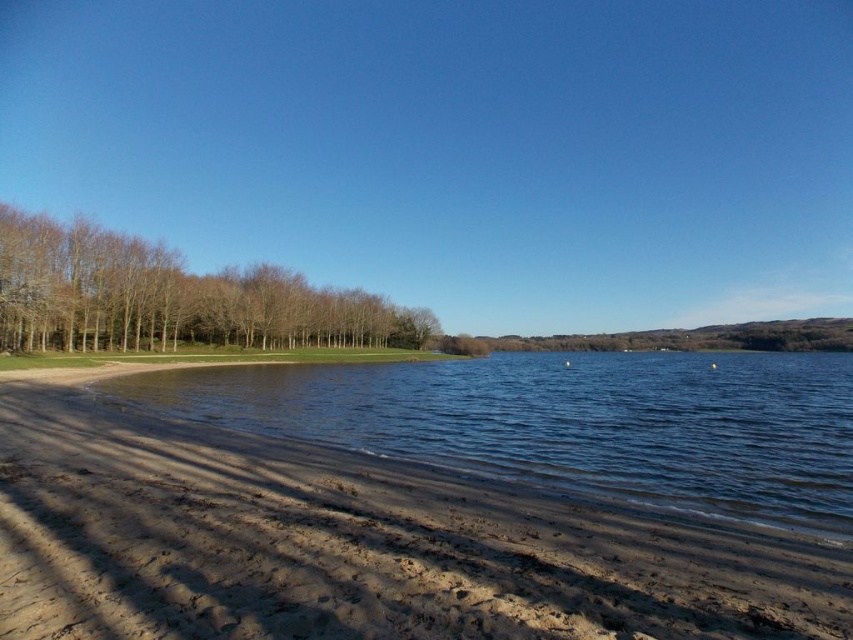
You are standing on the sandy beach and want to walk towards the brown leafless trees at left. Which part of the beach has a narrower path between the dark brown sand at lower left and the trees?

The dark brown sand at lower left is thinner than the brown leafless trees at left, so the narrower path is near the dark brown sand at lower left.